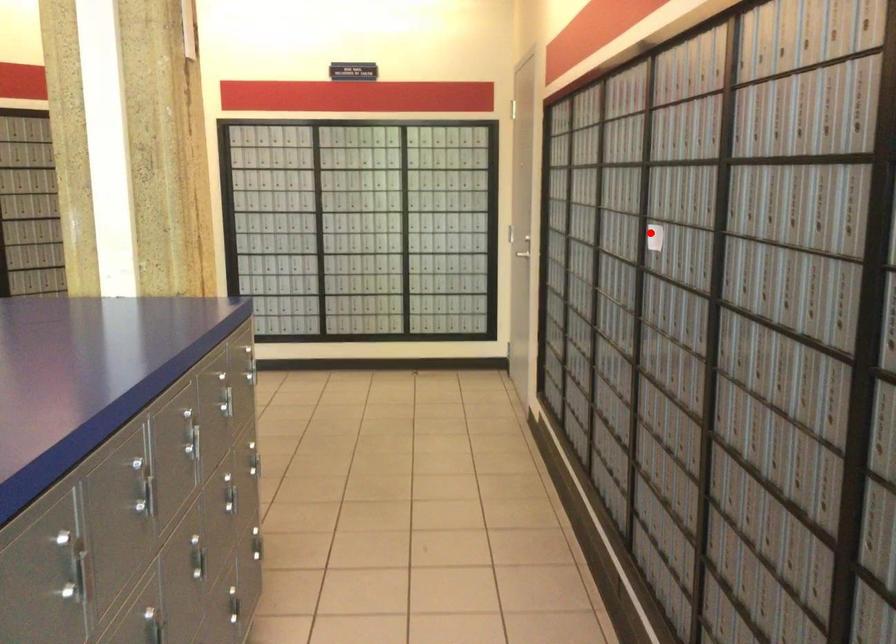
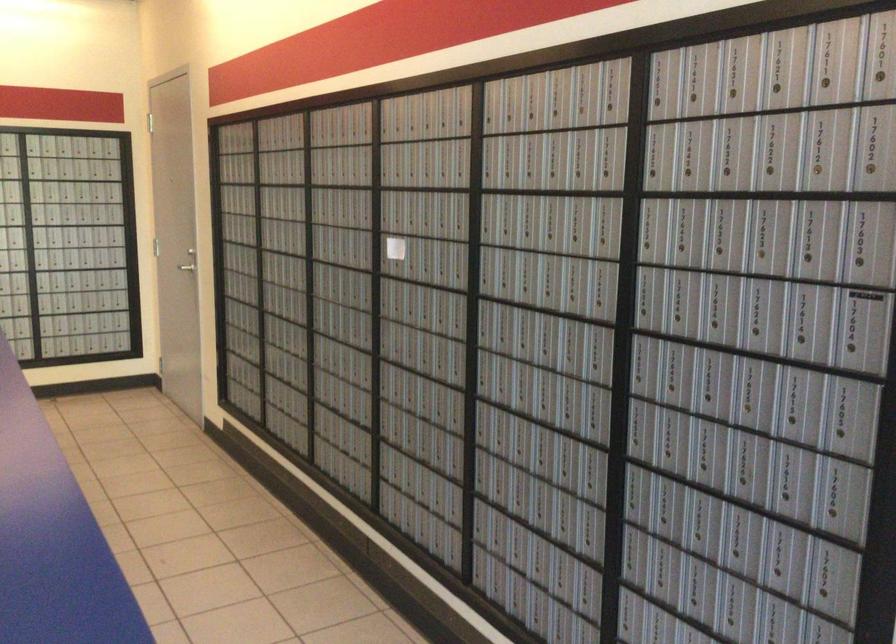
Find the pixel in the second image that matches the highlighted location in the first image.

(394, 248)